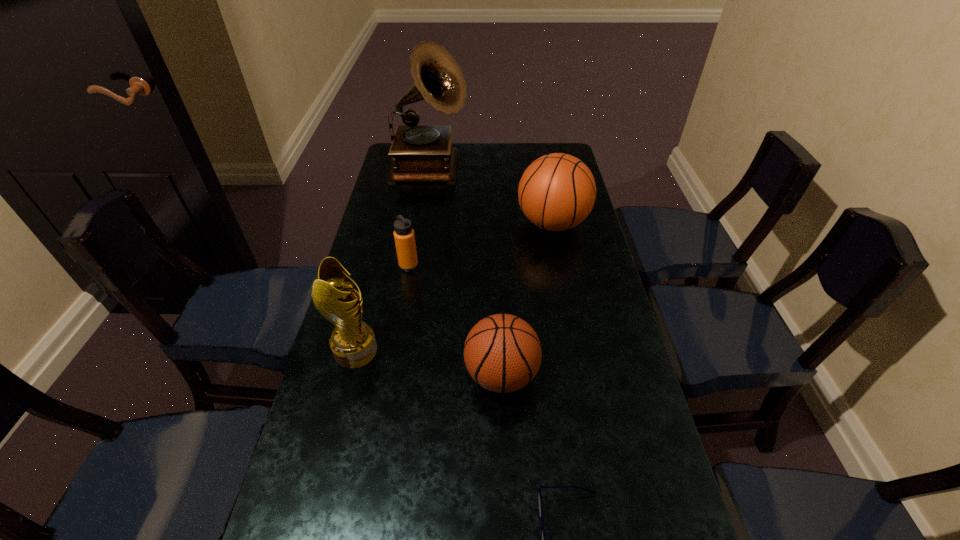
I want to click on vacant space located on the front of the fourth nearest object, so click(396, 336).

I want to click on vacant region located on the side where the inflation valve is located, so click(x=381, y=375).

The image size is (960, 540). I want to click on free location located 0.200m on the side where the inflation valve is located, so click(381, 375).

Image resolution: width=960 pixels, height=540 pixels. In order to click on free location located on the side where the inflation valve is located in this screenshot , I will do `click(335, 375)`.

This screenshot has width=960, height=540. What are the coordinates of `object at the far edge` in the screenshot? It's located at (421, 153).

I want to click on record player located at the left edge, so click(x=421, y=153).

The width and height of the screenshot is (960, 540). In order to click on award that is positioned at the left edge in this screenshot , I will do `click(353, 343)`.

Locate an element on the screen. thermos bottle that is at the left edge is located at coordinates (404, 236).

I want to click on object located in the right edge section of the desktop, so click(x=557, y=192).

I want to click on object that is at the far left corner, so click(421, 153).